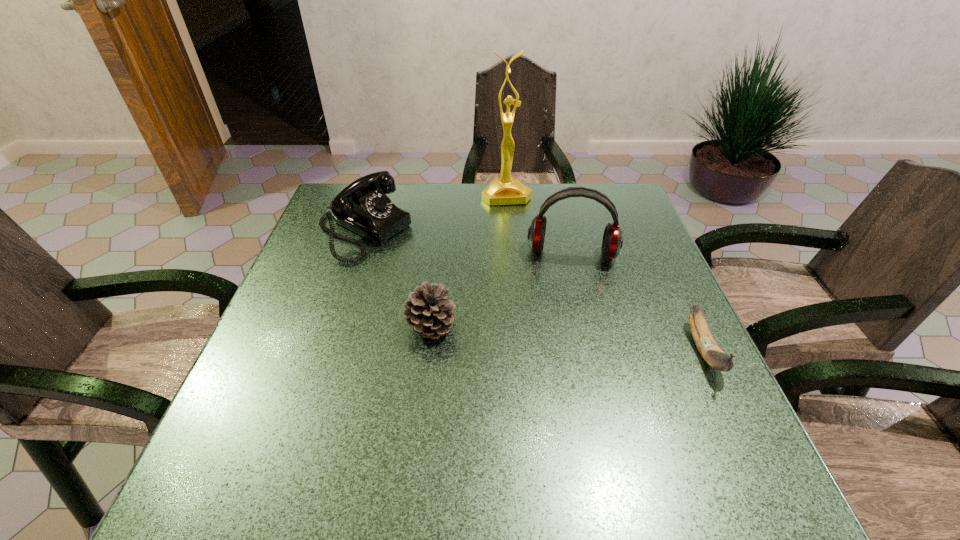
Identify which object is located as the third nearest to the pinecone. Please provide its 2D coordinates. Your answer should be formatted as a tuple, i.e. [(x, y)], where the tuple contains the x and y coordinates of a point satisfying the conditions above.

[(505, 190)]